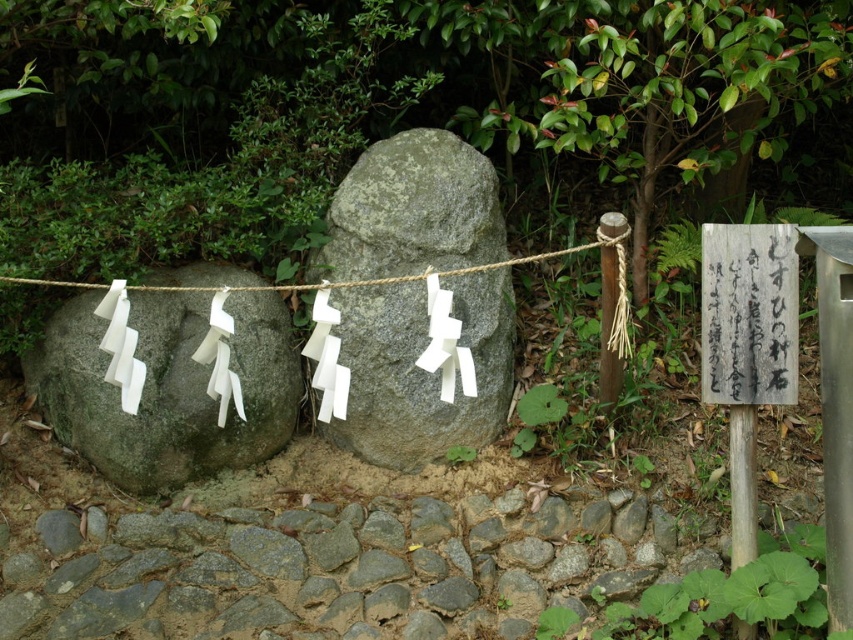
Question: Is gray rough stone at center further to camera compared to gray rough stone at left?

Choices:
 (A) no
 (B) yes

Answer: (B)

Question: Which object is positioned closest to the wooden signpost at center right?

Choices:
 (A) gray rough stone at center
 (B) gray rough stone at left
 (C) braided rope at center

Answer: (C)

Question: Which point is farther from the camera taking this photo?

Choices:
 (A) (202, 304)
 (B) (505, 244)

Answer: (B)

Question: Is the position of gray rough stone at center more distant than that of gray rough stone at left?

Choices:
 (A) yes
 (B) no

Answer: (A)

Question: Does wooden signpost at center right have a greater width compared to braided rope at center?

Choices:
 (A) yes
 (B) no

Answer: (B)

Question: Which point is farther from the camera taking this photo?

Choices:
 (A) (730, 364)
 (B) (492, 202)
 (C) (425, 273)
 (D) (180, 340)

Answer: (B)